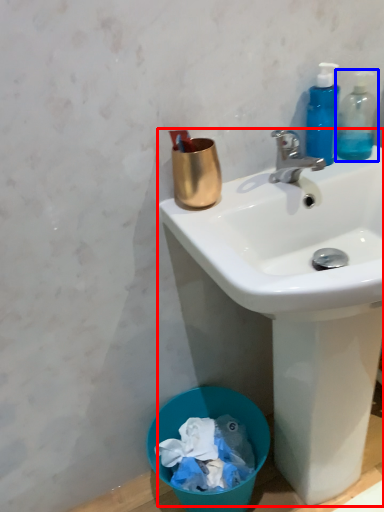
Question: Among these objects, which one is nearest to the camera, sink (highlighted by a red box) or bottle (highlighted by a blue box)?

Choices:
 (A) sink
 (B) bottle

Answer: (A)